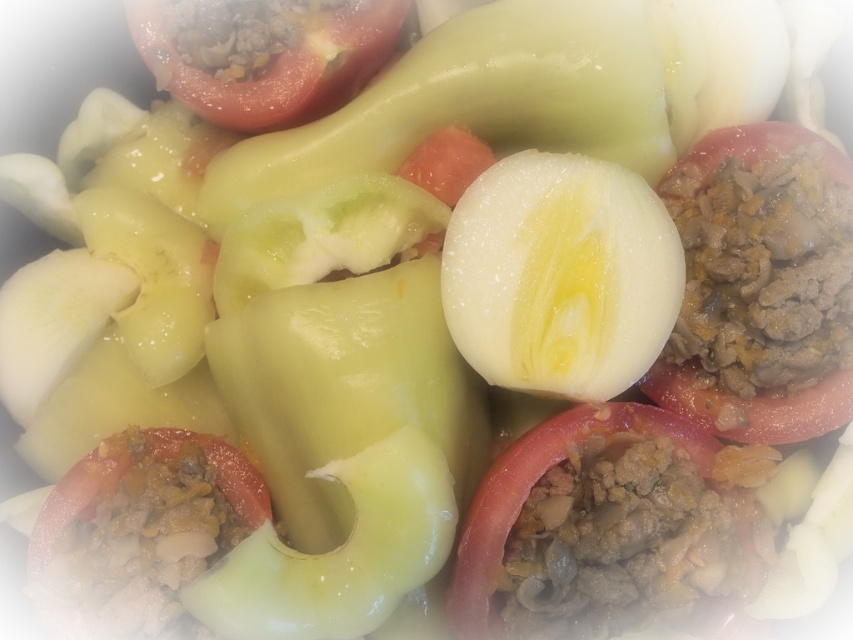
Question: Among these objects, which one is farthest from the camera?

Choices:
 (A) meaty tomato at center
 (B) brown crumbly meat at center

Answer: (B)

Question: Which of the following is the closest to the observer?

Choices:
 (A) (770, 380)
 (B) (161, 72)

Answer: (A)

Question: Is brown crumbly meat at center smaller than red matte tomato at upper left?

Choices:
 (A) yes
 (B) no

Answer: (B)

Question: Among these points, which one is farthest from the camera?

Choices:
 (A) (463, 355)
 (B) (228, 115)
 (C) (703, 275)
 (D) (509, 593)

Answer: (B)

Question: Does brown crumbly meat at center appear under red matte tomato at upper left?

Choices:
 (A) yes
 (B) no

Answer: (A)

Question: Can you confirm if tomato with ground meat filling at center is thinner than red matte tomato at upper left?

Choices:
 (A) yes
 (B) no

Answer: (A)